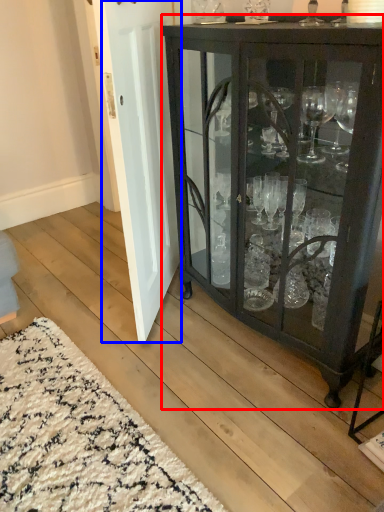
Question: Which of the following is the farthest to the observer, cupboard (highlighted by a red box) or door (highlighted by a blue box)?

Choices:
 (A) cupboard
 (B) door

Answer: (B)